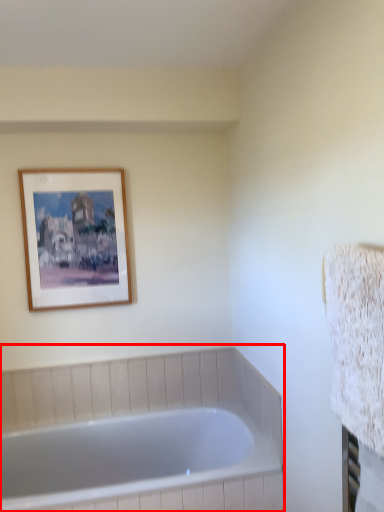
Question: From the image's perspective, where is bathtub (annotated by the red box) located relative to picture frame?

Choices:
 (A) above
 (B) below

Answer: (B)